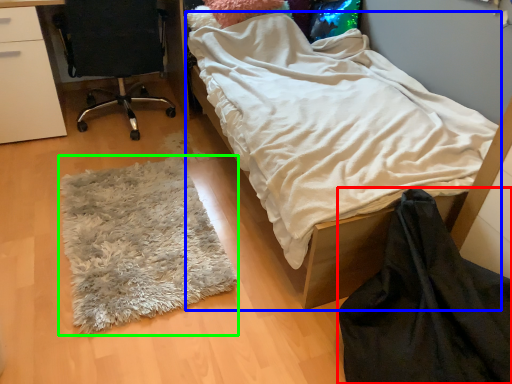
Question: Which object is positioned closest to blanket (highlighted by a red box)? Select from bed (highlighted by a blue box) and mat (highlighted by a green box).

Choices:
 (A) bed
 (B) mat

Answer: (A)